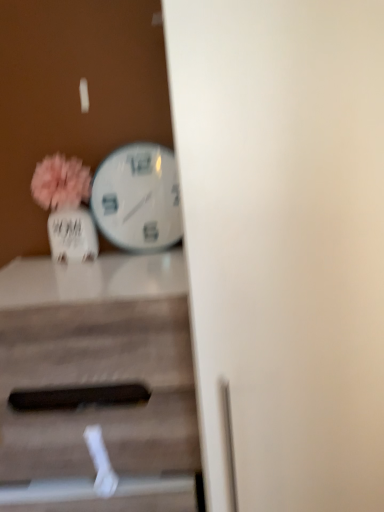
Question: Can you confirm if wooden table at center is positioned to the right of matte white vase at left?

Choices:
 (A) no
 (B) yes

Answer: (B)

Question: Does wooden table at center appear on the left side of matte white vase at left?

Choices:
 (A) yes
 (B) no

Answer: (B)

Question: Is the position of wooden table at center more distant than that of matte white vase at left?

Choices:
 (A) no
 (B) yes

Answer: (A)

Question: From a real-world perspective, does wooden table at center sit lower than matte white vase at left?

Choices:
 (A) no
 (B) yes

Answer: (B)

Question: Can you confirm if wooden table at center is taller than matte white vase at left?

Choices:
 (A) yes
 (B) no

Answer: (A)

Question: Relative to wooden table at center, is matte white vase at left in front or behind?

Choices:
 (A) behind
 (B) front

Answer: (A)

Question: From the image's perspective, is matte white vase at left positioned above or below wooden table at center?

Choices:
 (A) above
 (B) below

Answer: (A)

Question: In the image, is matte white vase at left on the left side or the right side of wooden table at center?

Choices:
 (A) left
 (B) right

Answer: (A)

Question: Looking at the image, does matte white vase at left seem bigger or smaller compared to wooden table at center?

Choices:
 (A) small
 (B) big

Answer: (A)

Question: In the image, is white glossy wall clock at center-left positioned in front of or behind matte white vase at left?

Choices:
 (A) front
 (B) behind

Answer: (B)

Question: From a real-world perspective, is white glossy wall clock at center-left physically located above or below matte white vase at left?

Choices:
 (A) above
 (B) below

Answer: (A)

Question: Based on their sizes in the image, would you say white glossy wall clock at center-left is bigger or smaller than matte white vase at left?

Choices:
 (A) small
 (B) big

Answer: (A)

Question: Does point (165, 239) appear closer or farther from the camera than point (44, 165)?

Choices:
 (A) farther
 (B) closer

Answer: (A)

Question: Is matte white vase at left inside the boundaries of white glossy wall clock at center-left, or outside?

Choices:
 (A) outside
 (B) inside

Answer: (A)

Question: From a real-world perspective, relative to white glossy wall clock at center-left, is matte white vase at left vertically above or below?

Choices:
 (A) above
 (B) below

Answer: (B)